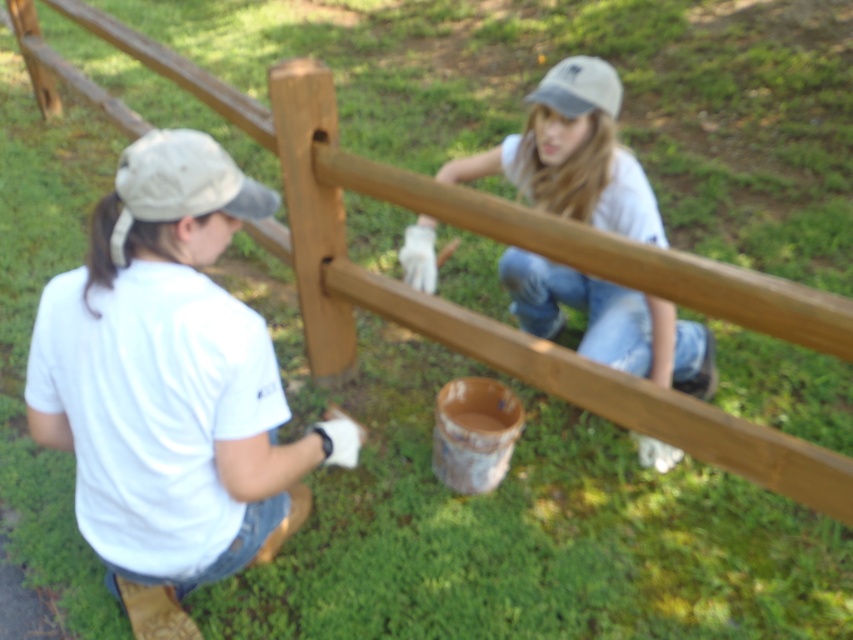
You are a painter standing near the wooden fence. You notice the white matte shirt at left and the white fabric baseball cap at upper left. Can you reach both items without moving your current position?

The white matte shirt at left is 14.92 inches away from the white fabric baseball cap at upper left. Since the distance between them is less than an arm length, you can likely reach both items without moving your current position.

You are a photographer trying to capture a clear shot of the white matte shirt at left and the white fabric baseball cap at upper center. Since both are white, you want to ensure they are distinguishable in the photo. Based on their positions, which object should you focus on first to ensure it appears in the foreground?

The white fabric baseball cap at upper center should be focused on first because it is closer to the photographer than the white matte shirt at left, which is positioned to the left side of it.